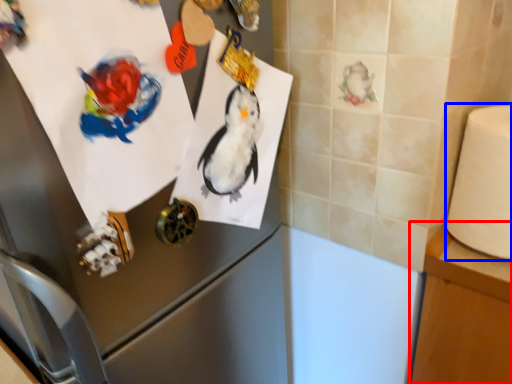
Question: Among these objects, which one is nearest to the camera, table (highlighted by a red box) or toilet paper (highlighted by a blue box)?

Choices:
 (A) table
 (B) toilet paper

Answer: (B)